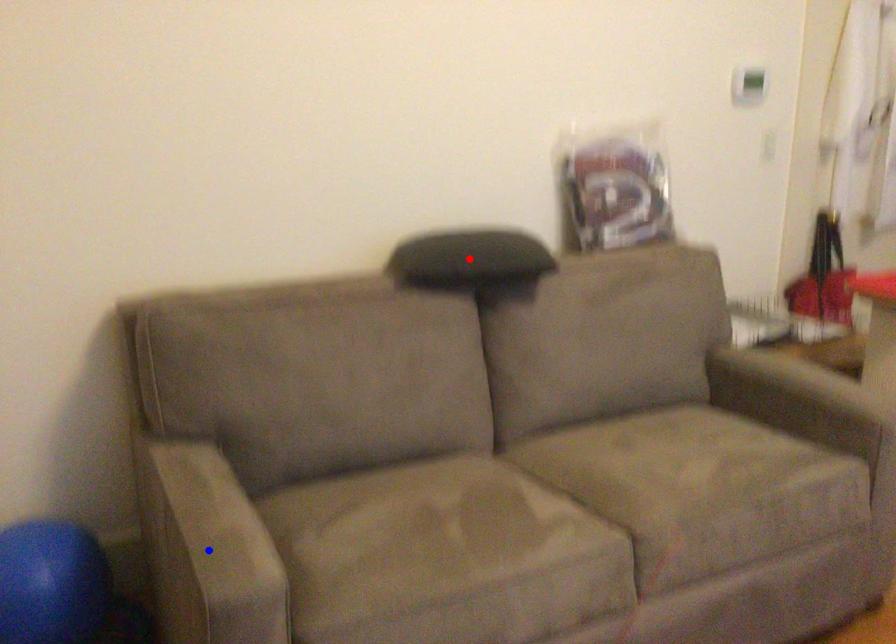
Question: In the image, two points are highlighted. Which point is nearer to the camera? Reply with the corresponding letter.

Choices:
 (A) blue point
 (B) red point

Answer: (A)